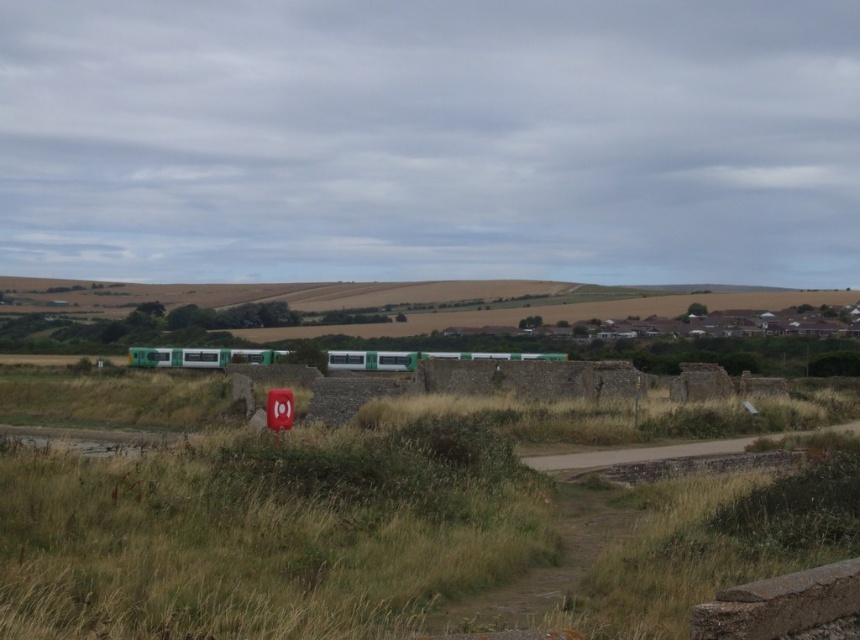
Question: Does green matte passenger train at center appear under smooth plastic sign at center?

Choices:
 (A) no
 (B) yes

Answer: (B)

Question: Which object appears farthest from the camera in this image?

Choices:
 (A) dirt road at center
 (B) smooth plastic sign at center
 (C) green matte passenger train at center

Answer: (C)

Question: Is dirt road at center to the left of smooth plastic sign at center from the viewer's perspective?

Choices:
 (A) no
 (B) yes

Answer: (A)

Question: Which point is closer to the camera?

Choices:
 (A) dirt road at center
 (B) smooth plastic sign at center

Answer: (B)

Question: Is dirt road at center smaller than smooth plastic sign at center?

Choices:
 (A) yes
 (B) no

Answer: (B)

Question: Which point is farther from the camera taking this photo?

Choices:
 (A) (689, 445)
 (B) (234, 349)
 (C) (290, 401)

Answer: (B)